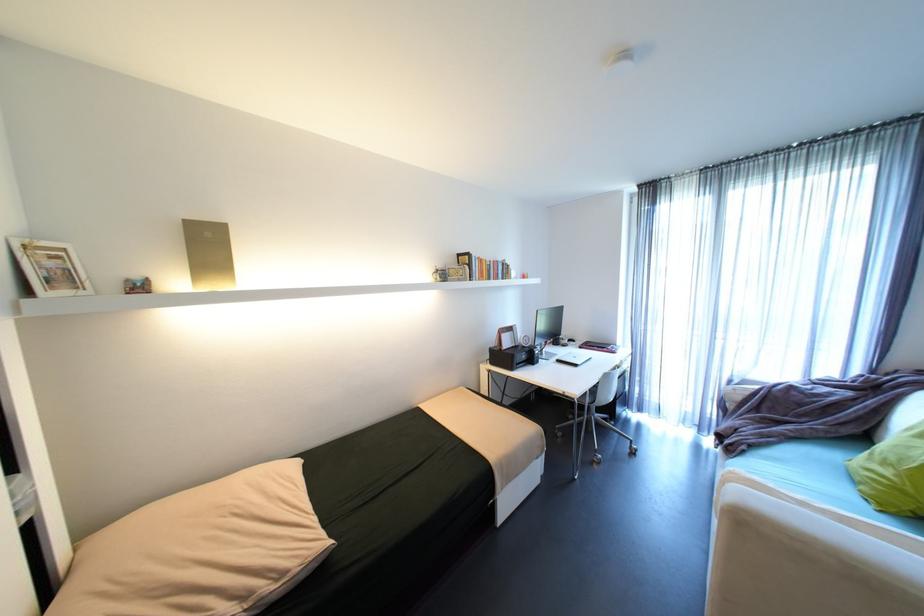
Where would you slid the computer mouse? Please return your answer as a coordinate pair (x, y).

(585, 351)